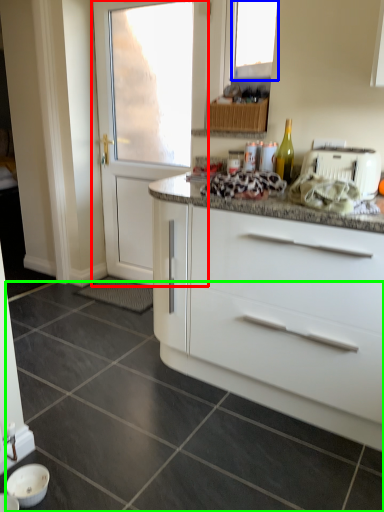
Question: Based on their relative distances, which object is farther from door (highlighted by a red box)? Choose from window (highlighted by a blue box) and granite (highlighted by a green box).

Choices:
 (A) window
 (B) granite

Answer: (B)